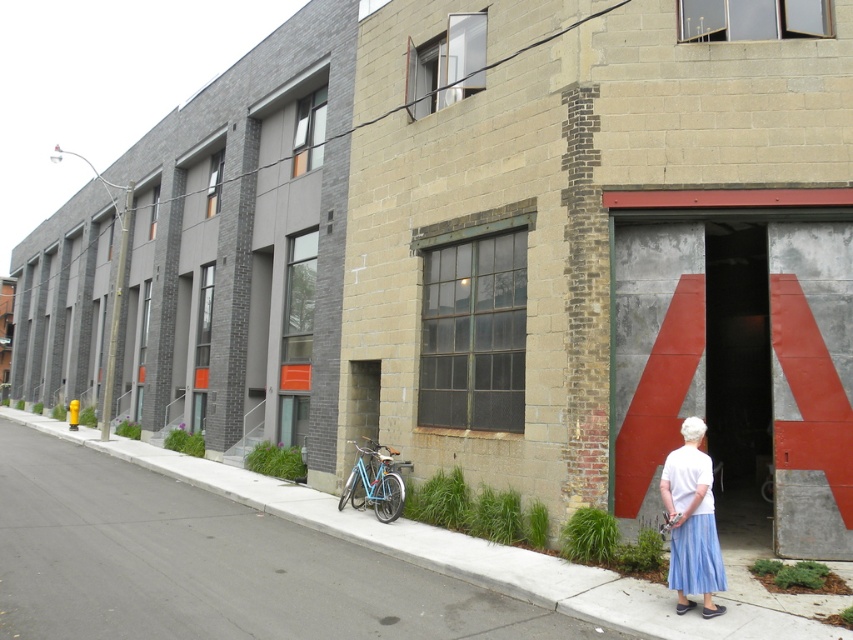
In the scene shown: You are a delivery person trying to park your light blue matte bicycle at lower center near the gray asphalt pavement at lower center. Can you safely place the bicycle on the pavement without it hanging off the edge?

The gray asphalt pavement at lower center is positioned under the light blue matte bicycle at lower center, meaning the bicycle is already resting on the pavement. Since the pavement is under the bicycle, there is no overhang, so it is safe to leave the bicycle there.

You are a delivery person with a 2.0 meter long cart. You need to park your cart between the gray asphalt pavement at lower center and the light blue matte bicycle at lower center. Is there enough space between them to park your cart?

The distance between the gray asphalt pavement at lower center and the light blue matte bicycle at lower center is 1.92 meters. Since your cart is 2.0 meters long, there is not enough space to park it between them.

You are a pedestrian standing at the edge of the gray asphalt pavement at lower center. You want to walk to the light blue pleated skirt at lower right. Which direction should you move to get closer to the skirt?

Since the gray asphalt pavement at lower center is closer to the viewer than the light blue pleated skirt at lower right, you should move forward away from the pavement towards the skirt to get closer.